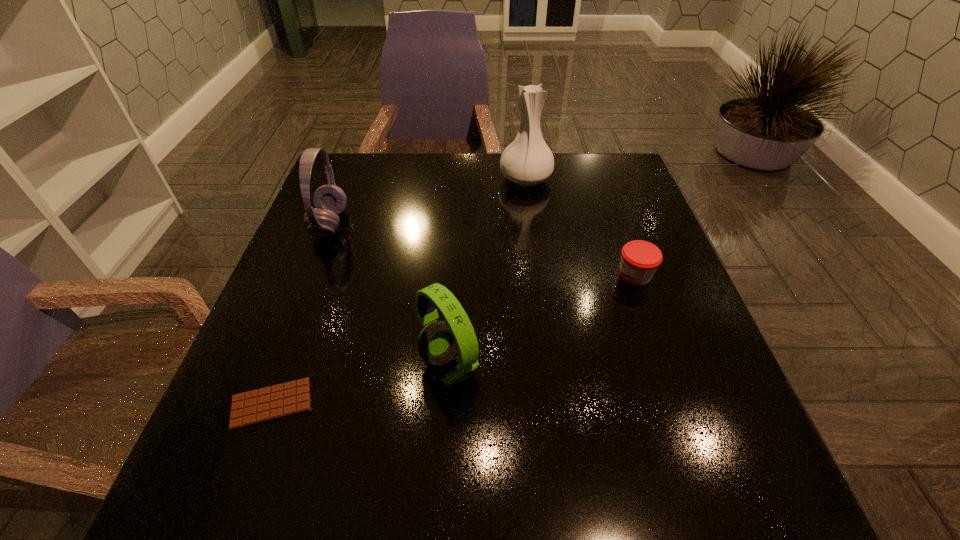
Identify the location of free space at the far edge. (507, 184).

The width and height of the screenshot is (960, 540). In order to click on vacant space at the near edge in this screenshot , I will do `click(457, 475)`.

Where is `free space at the left edge`? The image size is (960, 540). free space at the left edge is located at coordinates (262, 431).

Find the location of a particular element. This screenshot has height=540, width=960. free space at the right edge is located at coordinates (658, 411).

The width and height of the screenshot is (960, 540). What are the coordinates of `free space at the near right corner` in the screenshot? It's located at (774, 503).

In order to click on vacant area between the second farthest object and the farthest object in this screenshot , I will do [x=428, y=201].

Find the location of a particular element. blank region between the farther headset and the tallest object is located at coordinates (428, 201).

Where is `vacant space that is in between the third object from left to right and the fourth tallest object`? vacant space that is in between the third object from left to right and the fourth tallest object is located at coordinates (542, 321).

I want to click on free space between the nearer headset and the left headset, so click(x=390, y=295).

This screenshot has width=960, height=540. What are the coordinates of `free space between the left headset and the nearer headset` in the screenshot? It's located at (390, 295).